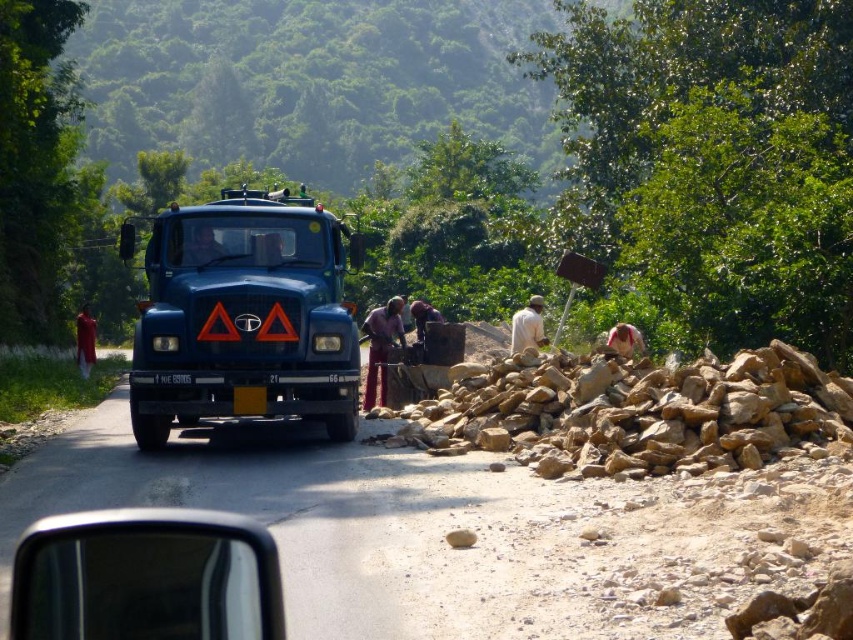
Is point (518, 340) less distant than point (206, 248)?

No, it is not.

Does white fabric shirt at center have a smaller size compared to matte black truck at center?

No, white fabric shirt at center is not smaller than matte black truck at center.

Which is in front, point (509, 342) or point (206, 230)?

Positioned in front is point (206, 230).

Locate an element on the screen. The width and height of the screenshot is (853, 640). white fabric shirt at center is located at coordinates (527, 326).

Which is below, brown fabric shirt at right or dark blue shirt at center?

Positioned lower is brown fabric shirt at right.

Between point (631, 330) and point (428, 312), which one is positioned in front?

Point (631, 330)

I want to click on brown fabric shirt at right, so pyautogui.click(x=625, y=340).

Does point (397, 296) lie behind point (531, 296)?

That is False.

Based on the photo, can you confirm if dark red fabric pants at center is positioned to the right of white fabric shirt at center?

In fact, dark red fabric pants at center is to the left of white fabric shirt at center.

Who is more forward, (384,337) or (520,310)?

Point (384,337) is in front.

You are a GUI agent. You are given a task and a screenshot of the screen. Output one action in this format:
    pyautogui.click(x=<x>, y=<y>)
    Task: Click on the dark red fabric pants at center
    This screenshot has width=853, height=640.
    Given the screenshot: What is the action you would take?
    pyautogui.click(x=381, y=346)